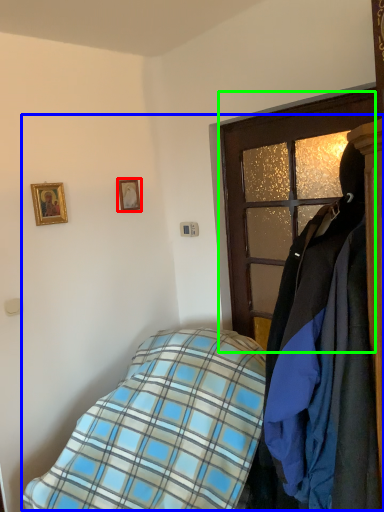
Question: Estimate the real-world distances between objects in this image. Which object is closer to picture frame (highlighted by a red box), bed (highlighted by a blue box) or door (highlighted by a green box)?

Choices:
 (A) bed
 (B) door

Answer: (B)